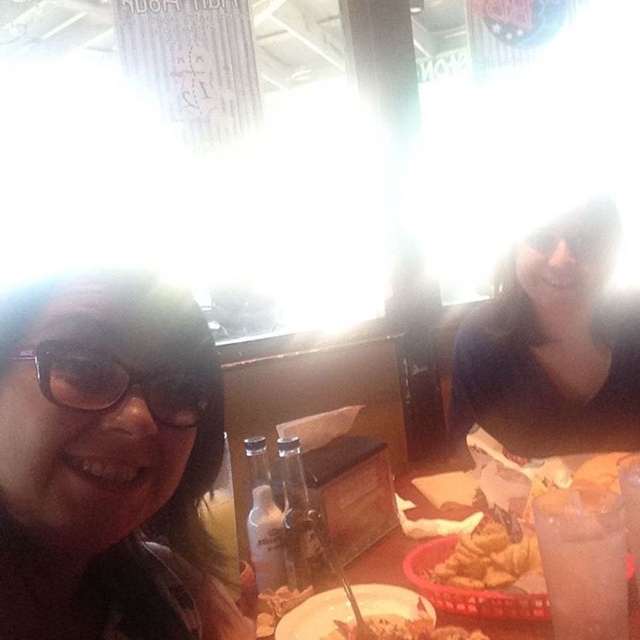
Question: Which point is closer to the camera taking this photo?

Choices:
 (A) (451, 563)
 (B) (604, 572)
 (C) (112, 369)

Answer: (C)

Question: Does matte black glasses at left appear on the right side of golden crispy fries at lower center?

Choices:
 (A) no
 (B) yes

Answer: (A)

Question: Which of the following is the farthest from the observer?

Choices:
 (A) golden crispy fries at lower center
 (B) matte black shirt at center

Answer: (B)

Question: Which point is farther to the camera?

Choices:
 (A) (168, 387)
 (B) (10, 417)
 (C) (403, 628)
 (D) (584, 500)

Answer: (C)

Question: Is matte plastic basket at center positioned behind black plastic goggles at left?

Choices:
 (A) no
 (B) yes

Answer: (B)

Question: Does matte black shirt at center come in front of golden crispy bread at center?

Choices:
 (A) no
 (B) yes

Answer: (A)